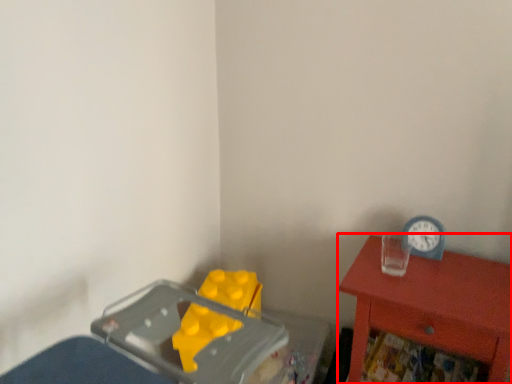
Question: Observing the image, what is the correct spatial positioning of nightstand (annotated by the red box) in reference to clock?

Choices:
 (A) left
 (B) right

Answer: (B)